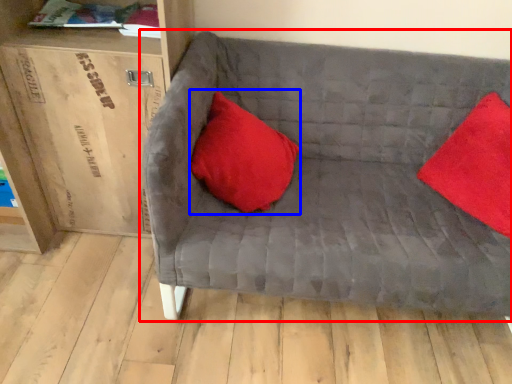
Question: Which point is closer to the camera, studio couch (highlighted by a red box) or pillow (highlighted by a blue box)?

Choices:
 (A) studio couch
 (B) pillow

Answer: (A)